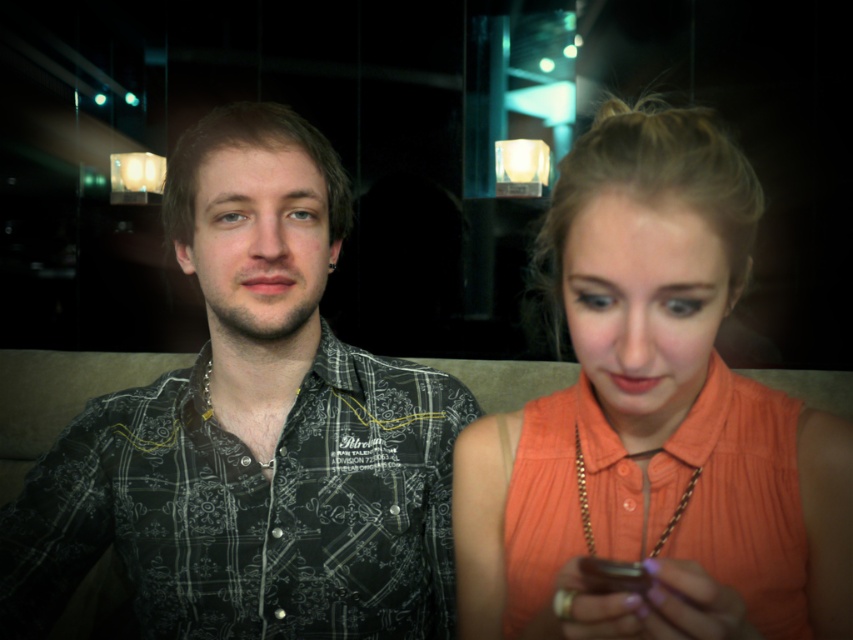
Who is more distant from viewer, (770, 557) or (763, 394)?

Positioned behind is point (763, 394).

Is point (695, 589) farther from viewer compared to point (770, 452)?

No, (695, 589) is closer to viewer.

Which is in front, point (590, 339) or point (666, 547)?

Point (590, 339)

Locate an element on the screen. This screenshot has height=640, width=853. orange fabric shirt at center is located at coordinates (654, 419).

Based on the photo, can you confirm if patterned shirt at left is thinner than orange fabric shirt at center?

No.

Between point (225, 490) and point (637, 243), which one is positioned in front?

Point (637, 243) is more forward.

Measure the distance between point (306, 241) and camera.

Point (306, 241) and camera are 73.33 centimeters apart from each other.

At what (x,y) coordinates should I click in order to perform the action: click on patterned shirt at left. Please return your answer as a coordinate pair (x, y). The height and width of the screenshot is (640, 853). Looking at the image, I should click on pos(252,433).

Does patterned shirt at left appear on the left side of orange satin shirt at lower right?

Indeed, patterned shirt at left is positioned on the left side of orange satin shirt at lower right.

Can you confirm if patterned shirt at left is wider than orange satin shirt at lower right?

Yes, patterned shirt at left is wider than orange satin shirt at lower right.

Is point (358, 550) farther from camera compared to point (529, 560)?

Yes, point (358, 550) is behind point (529, 560).

In order to click on patterned shirt at left in this screenshot , I will do `click(252, 433)`.